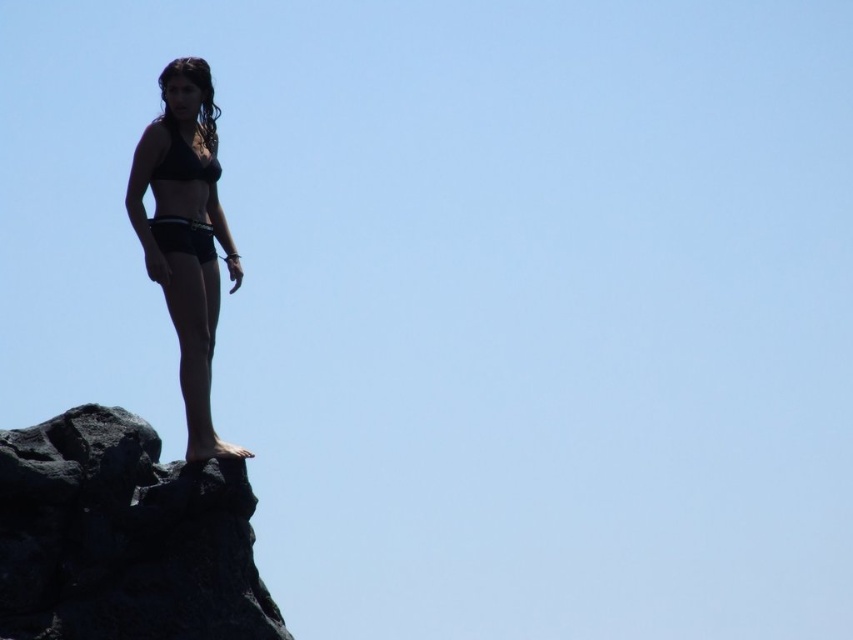
Question: Observing the image, what is the correct spatial positioning of black rough rock at upper left in reference to black matte bikini top at upper center?

Choices:
 (A) below
 (B) above

Answer: (A)

Question: Which object is closer to the camera taking this photo?

Choices:
 (A) black rough rock at upper left
 (B) black matte bikini top at upper center

Answer: (A)

Question: Which point is farther to the camera?

Choices:
 (A) (184, 156)
 (B) (196, 506)
 (C) (213, 445)

Answer: (A)

Question: Can you confirm if black rough rock at upper left is smaller than black matte bikini top at upper left?

Choices:
 (A) no
 (B) yes

Answer: (A)

Question: Among these points, which one is nearest to the camera?

Choices:
 (A) (201, 422)
 (B) (167, 161)
 (C) (225, 552)

Answer: (C)

Question: Is black matte bikini top at upper left to the left of black matte bikini top at upper center from the viewer's perspective?

Choices:
 (A) yes
 (B) no

Answer: (B)